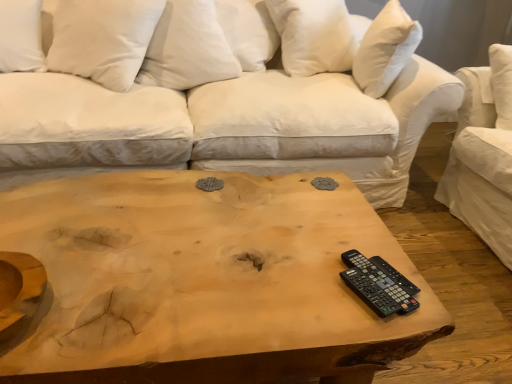
Image resolution: width=512 pixels, height=384 pixels. I want to click on blank space to the left of black plastic remote at lower right, so click(x=307, y=285).